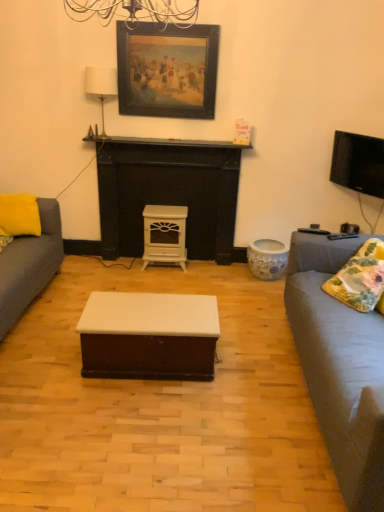
Question: Does floral fabric pillow at right, placed as the 2th pillow when sorted from back to front, have a lesser height compared to white matte wood coffee table at center?

Choices:
 (A) yes
 (B) no

Answer: (A)

Question: Is floral fabric pillow at right, the 2th pillow from the left, thinner than white matte wood coffee table at center?

Choices:
 (A) no
 (B) yes

Answer: (B)

Question: Are floral fabric pillow at right, which is the 1th pillow in right-to-left order, and white matte wood coffee table at center located far from each other?

Choices:
 (A) yes
 (B) no

Answer: (A)

Question: Is floral fabric pillow at right, which ranks as the first pillow in bottom-to-top order, in front of white matte wood coffee table at center?

Choices:
 (A) yes
 (B) no

Answer: (B)

Question: Is floral fabric pillow at right, the 2th pillow from the left, touching white matte wood coffee table at center?

Choices:
 (A) no
 (B) yes

Answer: (A)

Question: From the image's perspective, relative to floral fabric pillow at right, placed as the 2th pillow when sorted from back to front, is yellow fabric pillow at left, which appears as the 1th pillow when viewed from the top, above or below?

Choices:
 (A) below
 (B) above

Answer: (B)

Question: Looking at the image, does yellow fabric pillow at left, the 2th pillow positioned from the front, seem bigger or smaller compared to floral fabric pillow at right, which ranks as the first pillow in bottom-to-top order?

Choices:
 (A) big
 (B) small

Answer: (A)

Question: Considering the positions of point (3, 200) and point (380, 286), is point (3, 200) closer or farther from the camera than point (380, 286)?

Choices:
 (A) farther
 (B) closer

Answer: (A)

Question: In terms of width, does yellow fabric pillow at left, which appears as the 1th pillow when viewed from the top, look wider or thinner when compared to floral fabric pillow at right, which is the 1th pillow in right-to-left order?

Choices:
 (A) thin
 (B) wide

Answer: (B)

Question: Is floral fabric pillow at right, placed as the 2th pillow when sorted from back to front, to the left or to the right of black matte fireplace at center in the image?

Choices:
 (A) right
 (B) left

Answer: (A)

Question: From the image's perspective, is floral fabric pillow at right, the 2th pillow from the left, located above or below black matte fireplace at center?

Choices:
 (A) above
 (B) below

Answer: (B)

Question: From a real-world perspective, relative to black matte fireplace at center, is floral fabric pillow at right, the 2th pillow from the left, vertically above or below?

Choices:
 (A) above
 (B) below

Answer: (B)

Question: Is floral fabric pillow at right, the 2th pillow from the left, taller or shorter than black matte fireplace at center?

Choices:
 (A) short
 (B) tall

Answer: (B)

Question: Is floral fabric pillow at right, the 2th pillow from the left, inside the boundaries of yellow fabric pillow at left, which appears as the 2th pillow when ordered from the bottom, or outside?

Choices:
 (A) outside
 (B) inside

Answer: (A)

Question: Looking at their shapes, would you say floral fabric pillow at right, which is the 1th pillow in right-to-left order, is wider or thinner than yellow fabric pillow at left, which appears as the 2th pillow when ordered from the bottom?

Choices:
 (A) wide
 (B) thin

Answer: (B)